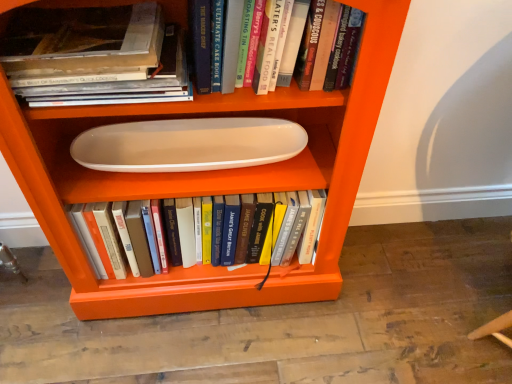
Question: From the image's perspective, is white glossy oval plate at center above or below white glossy oval tray at center?

Choices:
 (A) below
 (B) above

Answer: (B)

Question: In terms of height, does white glossy oval plate at center look taller or shorter compared to white glossy oval tray at center?

Choices:
 (A) tall
 (B) short

Answer: (B)

Question: Estimate the real-world distances between objects in this image. Which object is farther from the white glossy oval plate at center?

Choices:
 (A) matte white book at upper left, which is counted as the 2th book, starting from the front
 (B) hardcover book at upper center, which ranks as the third book in back-to-front order
 (C) white glossy oval tray at center
 (D) white matte oval plate at center, the first book when ordered from back to front

Answer: (B)

Question: Which of these objects is positioned closest to the white glossy oval plate at center?

Choices:
 (A) hardcover book at upper center, which ranks as the third book in back-to-front order
 (B) matte white book at upper left, which is counted as the 2th book, starting from the front
 (C) white matte oval plate at center, the first book when ordered from back to front
 (D) white glossy oval tray at center

Answer: (D)